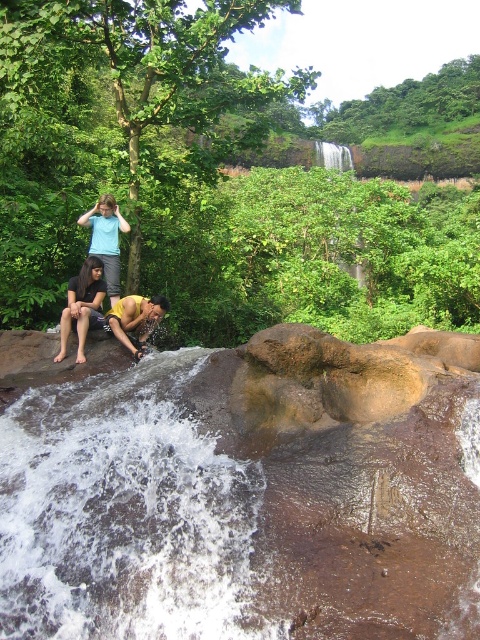
Question: Estimate the real-world distances between objects in this image. Which object is closer to the yellow matte shirt at center?

Choices:
 (A) white frothy water at center
 (B) dark brown hair at lower left
 (C) matte blue shirt at center
 (D) matte blue shirt at upper left

Answer: (B)

Question: Can you confirm if dark brown hair at lower left is positioned below yellow matte shirt at center?

Choices:
 (A) yes
 (B) no

Answer: (B)

Question: Can you confirm if matte blue shirt at center is positioned above dark brown hair at lower left?

Choices:
 (A) yes
 (B) no

Answer: (A)

Question: Is matte blue shirt at center closer to camera compared to yellow matte shirt at center?

Choices:
 (A) yes
 (B) no

Answer: (A)

Question: Which of the following is the closest to the observer?

Choices:
 (A) (106, 214)
 (B) (91, 294)
 (C) (121, 316)

Answer: (C)

Question: Which of the following is the farthest from the observer?

Choices:
 (A) (94, 298)
 (B) (117, 296)

Answer: (B)